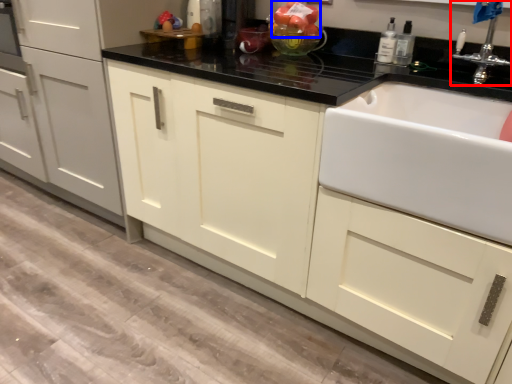
Question: Which object appears closest to the camera in this image, tap (highlighted by a red box) or fruit (highlighted by a blue box)?

Choices:
 (A) tap
 (B) fruit

Answer: (A)